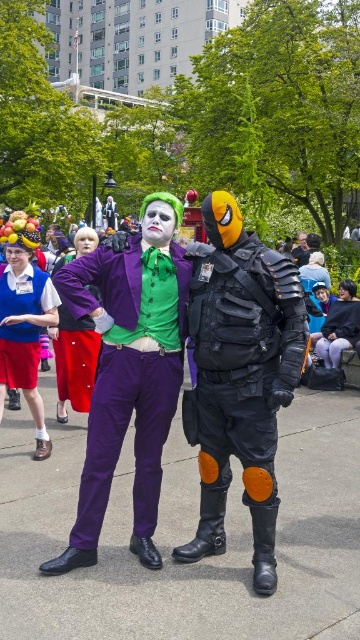
Question: Does matte black tactical vest at center lie behind matte blue vest at left?

Choices:
 (A) yes
 (B) no

Answer: (B)

Question: Can you confirm if matte black tactical vest at center is smaller than purple matte pants at center?

Choices:
 (A) yes
 (B) no

Answer: (B)

Question: Can you confirm if matte blue vest at left is thinner than matte purple pants at center?

Choices:
 (A) yes
 (B) no

Answer: (A)

Question: Estimate the real-world distances between objects in this image. Which object is farther from the purple matte pants at center?

Choices:
 (A) purple matte suit at center
 (B) matte blue vest at center
 (C) matte purple pants at center

Answer: (C)

Question: Among these objects, which one is farthest from the camera?

Choices:
 (A) matte black tactical vest at center
 (B) purple matte suit at center
 (C) matte blue vest at left

Answer: (C)

Question: Which point is closer to the camera?

Choices:
 (A) matte black tactical vest at center
 (B) matte blue vest at center

Answer: (A)